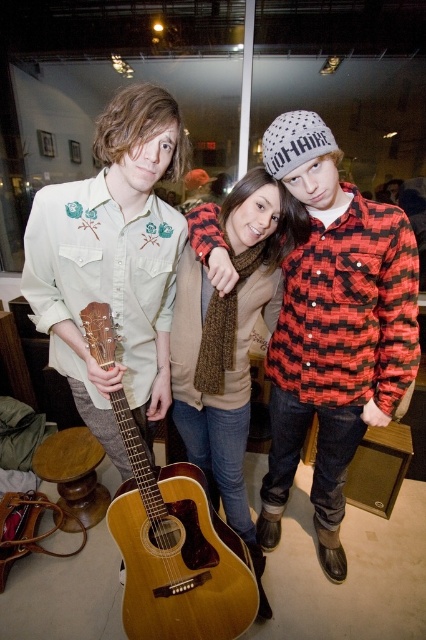
Question: Among these objects, which one is farthest from the camera?

Choices:
 (A) brown knitted scarf at center
 (B) matte light green shirt at center

Answer: (A)

Question: Does brown knitted scarf at center have a smaller size compared to light brown wooden guitar at center?

Choices:
 (A) no
 (B) yes

Answer: (A)

Question: Can you confirm if red plaid shirt at center is wider than matte light green shirt at center?

Choices:
 (A) yes
 (B) no

Answer: (A)

Question: Is the position of red plaid shirt at center more distant than that of brown knitted scarf at center?

Choices:
 (A) no
 (B) yes

Answer: (A)

Question: Which point is closer to the camera?

Choices:
 (A) red plaid shirt at center
 (B) matte light green shirt at center
 (C) light brown wooden guitar at center
 (D) brown knitted scarf at center

Answer: (B)

Question: Which object is positioned farthest from the red plaid shirt at center?

Choices:
 (A) brown knitted scarf at center
 (B) light brown wooden guitar at center

Answer: (B)